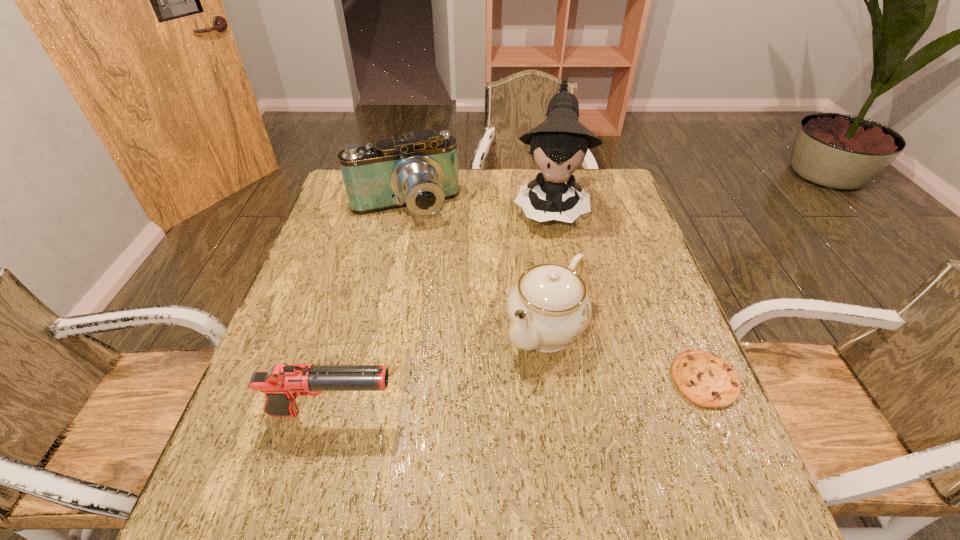
I want to click on cookie that is at the right edge, so click(705, 379).

Find the location of a particular element. The width and height of the screenshot is (960, 540). doll present at the right edge is located at coordinates tap(559, 145).

Find the location of a particular element. The width and height of the screenshot is (960, 540). object located in the far left corner section of the desktop is located at coordinates (419, 171).

Locate an element on the screen. The height and width of the screenshot is (540, 960). object at the near left corner is located at coordinates (282, 384).

This screenshot has width=960, height=540. Find the location of `object at the far right corner`. object at the far right corner is located at coordinates (559, 145).

In the image, there is a desktop. Identify the location of free space at the far edge. [474, 179].

Identify the location of vacant region at the near edge of the desktop. This screenshot has width=960, height=540. (444, 430).

You are a GUI agent. You are given a task and a screenshot of the screen. Output one action in this format:
    pyautogui.click(x=<x>, y=<y>)
    Task: Click on the free point at the left edge
    This screenshot has height=540, width=960.
    Given the screenshot: What is the action you would take?
    pyautogui.click(x=343, y=290)

You are a GUI agent. You are given a task and a screenshot of the screen. Output one action in this format:
    pyautogui.click(x=<x>, y=<y>)
    Task: Click on the free region at the right edge of the desktop
    This screenshot has height=540, width=960.
    Given the screenshot: What is the action you would take?
    pyautogui.click(x=607, y=258)

Where is `blank space at the far right corner of the desktop`? This screenshot has width=960, height=540. blank space at the far right corner of the desktop is located at coordinates (603, 184).